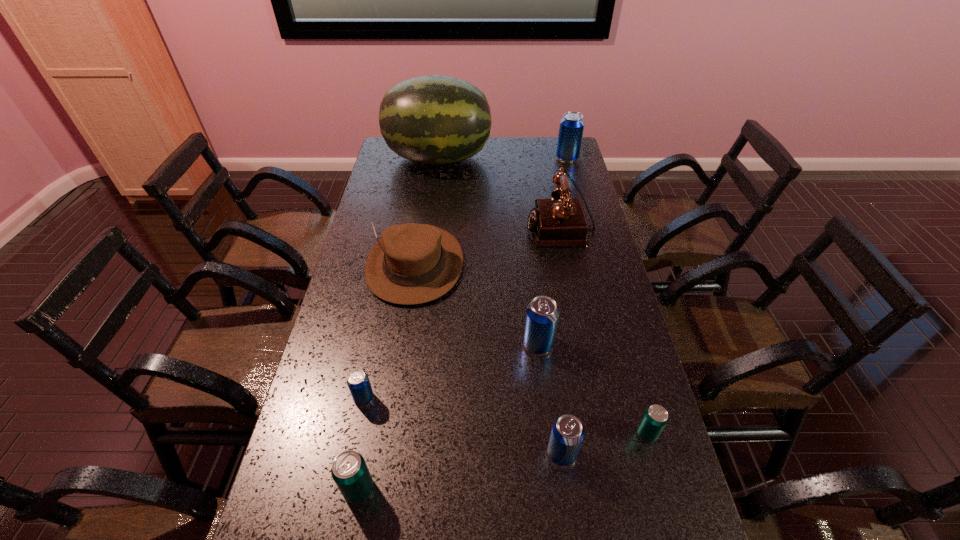
Locate an element on the screen. Image resolution: width=960 pixels, height=540 pixels. telephone located in the right edge section of the desktop is located at coordinates (556, 222).

At what (x,y) coordinates should I click in order to perform the action: click on object that is at the far left corner. Please return your answer as a coordinate pair (x, y). The height and width of the screenshot is (540, 960). Looking at the image, I should click on (433, 119).

What are the coordinates of `object that is at the far right corner` in the screenshot? It's located at (571, 128).

The image size is (960, 540). Identify the location of free space at the far edge of the desktop. (496, 160).

Locate an element on the screen. vacant space at the left edge of the desktop is located at coordinates (326, 363).

You are a GUI agent. You are given a task and a screenshot of the screen. Output one action in this format:
    pyautogui.click(x=<x>, y=<y>)
    Task: Click on the free space at the right edge
    Image resolution: width=960 pixels, height=540 pixels.
    Given the screenshot: What is the action you would take?
    click(x=603, y=332)

The width and height of the screenshot is (960, 540). I want to click on blank area at the far left corner, so click(x=382, y=164).

The image size is (960, 540). Find the location of `vacant space that is in between the telephone and the smaller teal beer can`. vacant space that is in between the telephone and the smaller teal beer can is located at coordinates (604, 330).

Identify the location of free space between the third smallest blue beer can and the nearest blue beer can. Image resolution: width=960 pixels, height=540 pixels. (550, 399).

I want to click on vacant space that is in between the farther teal beer can and the farthest beer can, so click(x=607, y=296).